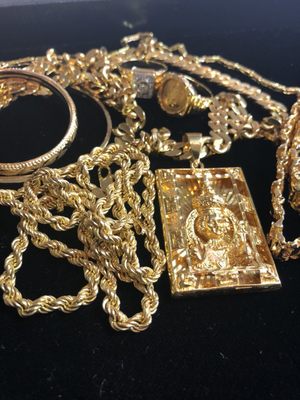
In order to click on gold pendant in this screenshot , I will do `click(217, 235)`, `click(177, 192)`, `click(229, 185)`.